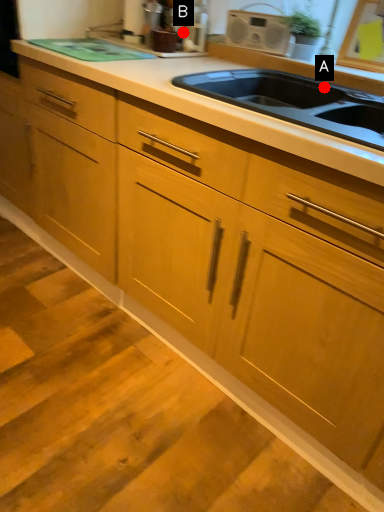
Question: Two points are circled on the image, labeled by A and B beside each circle. Among these points, which one is farthest from the camera?

Choices:
 (A) A is further
 (B) B is further

Answer: (B)